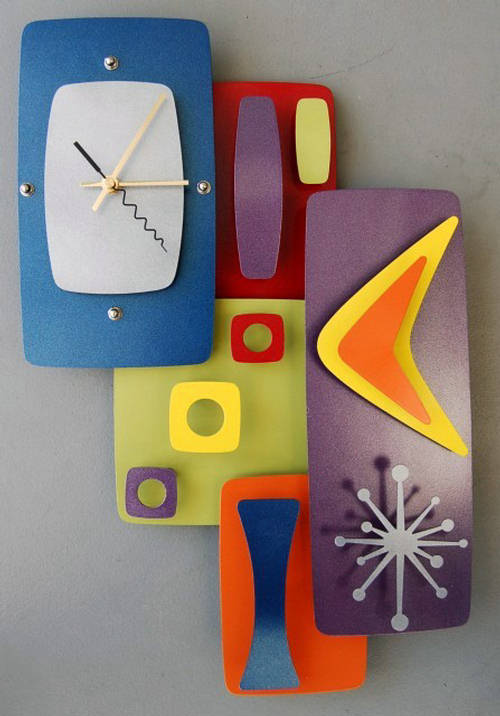
Identify the location of left of clock. The height and width of the screenshot is (716, 500). (7, 314).